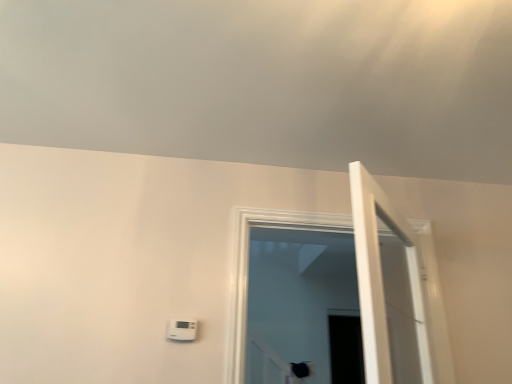
Question: Does white plastic thermostat at lower center have a lesser height compared to white wooden door at right?

Choices:
 (A) yes
 (B) no

Answer: (A)

Question: Does white plastic thermostat at lower center appear on the right side of white wooden door at right?

Choices:
 (A) no
 (B) yes

Answer: (A)

Question: Does white plastic thermostat at lower center have a larger size compared to white wooden door at right?

Choices:
 (A) yes
 (B) no

Answer: (B)

Question: From a real-world perspective, is white plastic thermostat at lower center located beneath white wooden door at right?

Choices:
 (A) yes
 (B) no

Answer: (A)

Question: From the image's perspective, is white plastic thermostat at lower center over white wooden door at right?

Choices:
 (A) yes
 (B) no

Answer: (B)

Question: Are white plastic thermostat at lower center and white wooden door at right far apart?

Choices:
 (A) yes
 (B) no

Answer: (B)

Question: Is white plastic thermostat at lower center behind transparent glass door at center?

Choices:
 (A) no
 (B) yes

Answer: (B)

Question: Considering the relative sizes of white plastic thermostat at lower center and transparent glass door at center in the image provided, is white plastic thermostat at lower center thinner than transparent glass door at center?

Choices:
 (A) no
 (B) yes

Answer: (B)

Question: Considering the relative positions of white plastic thermostat at lower center and transparent glass door at center in the image provided, is white plastic thermostat at lower center to the right of transparent glass door at center from the viewer's perspective?

Choices:
 (A) yes
 (B) no

Answer: (B)

Question: From the image's perspective, does white plastic thermostat at lower center appear higher than transparent glass door at center?

Choices:
 (A) no
 (B) yes

Answer: (A)

Question: Can you confirm if white plastic thermostat at lower center is wider than transparent glass door at center?

Choices:
 (A) no
 (B) yes

Answer: (A)

Question: Does white plastic thermostat at lower center have a smaller size compared to transparent glass door at center?

Choices:
 (A) no
 (B) yes

Answer: (B)

Question: Is transparent glass door at center at the left side of white wooden door at right?

Choices:
 (A) no
 (B) yes

Answer: (B)